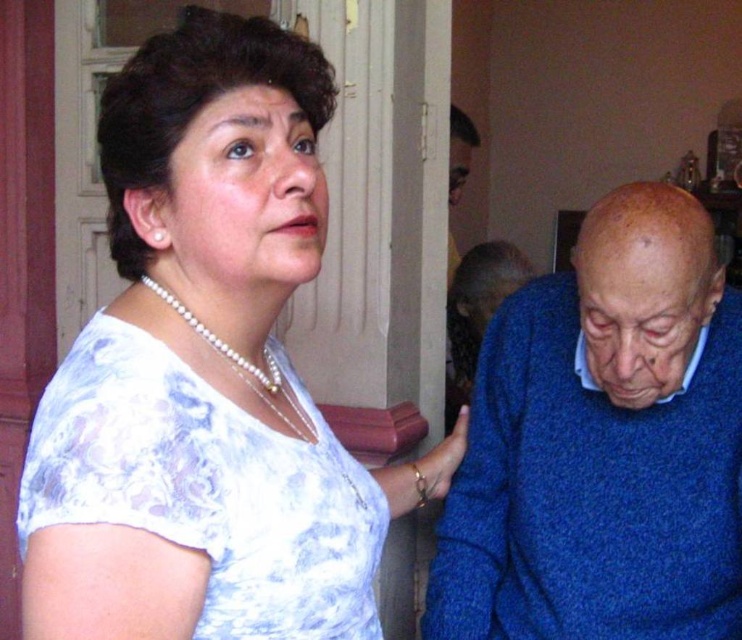
You are a photographer trying to capture a candid shot of the two people in the scene. The camera you are using has a maximum focus range of 25 inches. Can you focus on both the white lace blouse at upper left and the person on the right at the same time?

The two people are 25.66 inches apart, which exceeds the camera maximum focus range of 25 inches. Therefore, you cannot focus on both the white lace blouse at upper left and the person on the right simultaneously.

What is located at the coordinates point (197, 348) in the image?

The white lace blouse at upper left is located at point (197, 348).